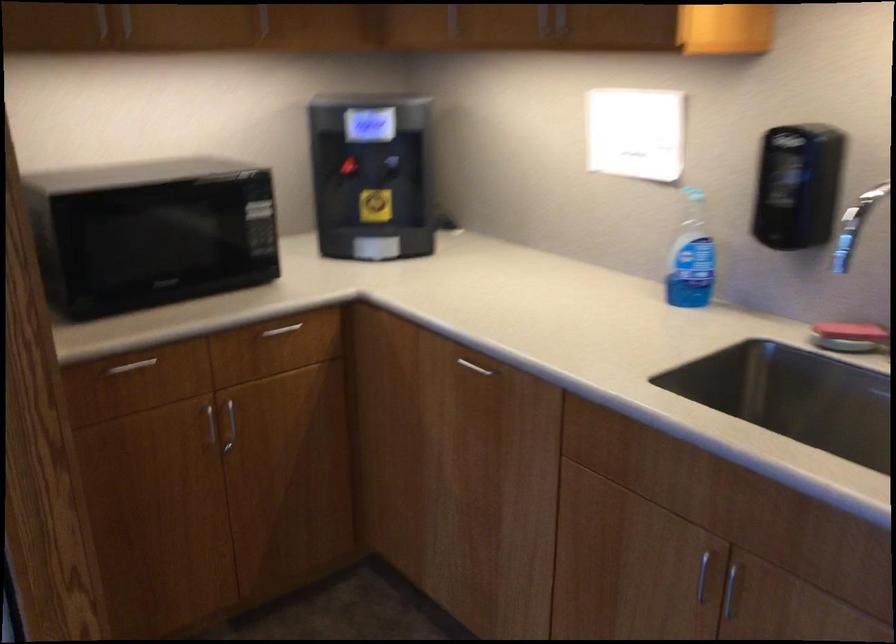
Find where to push the microwave door button. Please return your answer as a coordinate pair (x, y).

(262, 232)